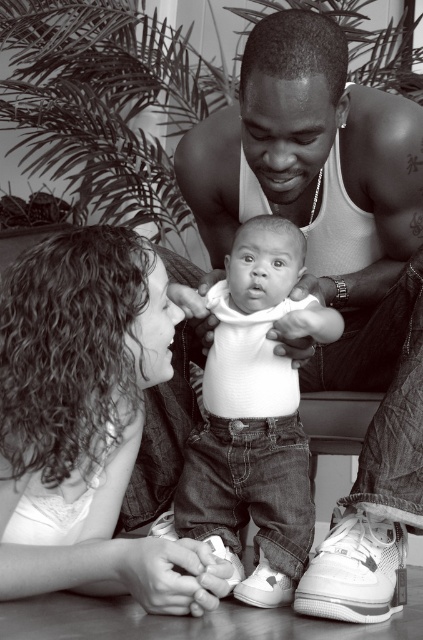
Question: Can you confirm if curly hair at center is wider than white soft fabric baby at center?

Choices:
 (A) no
 (B) yes

Answer: (B)

Question: Where is curly hair at center located in relation to white soft fabric baby at center in the image?

Choices:
 (A) right
 (B) left

Answer: (B)

Question: Can you confirm if curly hair at center is positioned below white soft fabric baby at center?

Choices:
 (A) no
 (B) yes

Answer: (B)